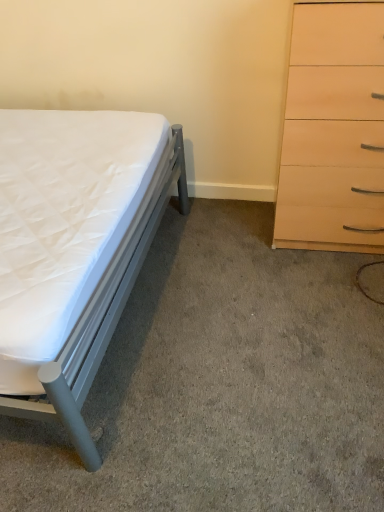
Question: Can you confirm if white quilted mattress at left is positioned to the right of white quilted mattress at lower left?

Choices:
 (A) no
 (B) yes

Answer: (A)

Question: Is white quilted mattress at left aimed at white quilted mattress at lower left?

Choices:
 (A) yes
 (B) no

Answer: (A)

Question: Considering the relative sizes of white quilted mattress at left and white quilted mattress at lower left in the image provided, is white quilted mattress at left thinner than white quilted mattress at lower left?

Choices:
 (A) yes
 (B) no

Answer: (A)

Question: From the image's perspective, would you say white quilted mattress at left is shown under white quilted mattress at lower left?

Choices:
 (A) no
 (B) yes

Answer: (A)

Question: From a real-world perspective, does white quilted mattress at left stand above white quilted mattress at lower left?

Choices:
 (A) no
 (B) yes

Answer: (B)

Question: Considering the positions of white quilted mattress at left and light wood/finish chest of drawers at right in the image, is white quilted mattress at left bigger or smaller than light wood/finish chest of drawers at right?

Choices:
 (A) big
 (B) small

Answer: (A)

Question: Is white quilted mattress at left taller or shorter than light wood/finish chest of drawers at right?

Choices:
 (A) tall
 (B) short

Answer: (B)

Question: Looking at their shapes, would you say white quilted mattress at left is wider or thinner than light wood/finish chest of drawers at right?

Choices:
 (A) wide
 (B) thin

Answer: (A)

Question: Is white quilted mattress at left situated inside light wood/finish chest of drawers at right or outside?

Choices:
 (A) outside
 (B) inside

Answer: (A)

Question: From the image's perspective, is light wood/finish chest of drawers at right above or below white quilted mattress at left?

Choices:
 (A) below
 (B) above

Answer: (B)

Question: From a real-world perspective, is light wood/finish chest of drawers at right above or below white quilted mattress at left?

Choices:
 (A) below
 (B) above

Answer: (B)

Question: Do you think light wood/finish chest of drawers at right is within white quilted mattress at left, or outside of it?

Choices:
 (A) outside
 (B) inside

Answer: (A)

Question: Based on their sizes in the image, would you say light wood/finish chest of drawers at right is bigger or smaller than white quilted mattress at left?

Choices:
 (A) small
 (B) big

Answer: (A)

Question: From the image's perspective, is white quilted mattress at left above or below white quilted mattress at lower left?

Choices:
 (A) below
 (B) above

Answer: (B)

Question: Based on their sizes in the image, would you say white quilted mattress at left is bigger or smaller than white quilted mattress at lower left?

Choices:
 (A) small
 (B) big

Answer: (B)